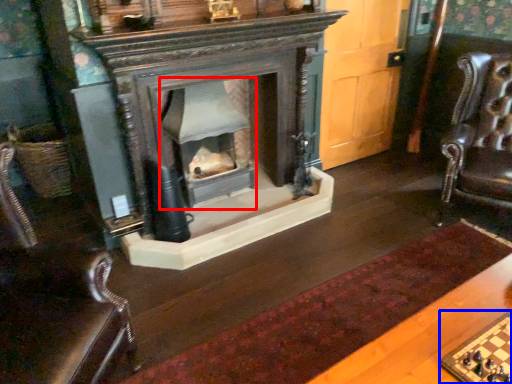
Question: Among these objects, which one is farthest to the camera, fireplace (highlighted by a red box) or board game (highlighted by a blue box)?

Choices:
 (A) fireplace
 (B) board game

Answer: (A)